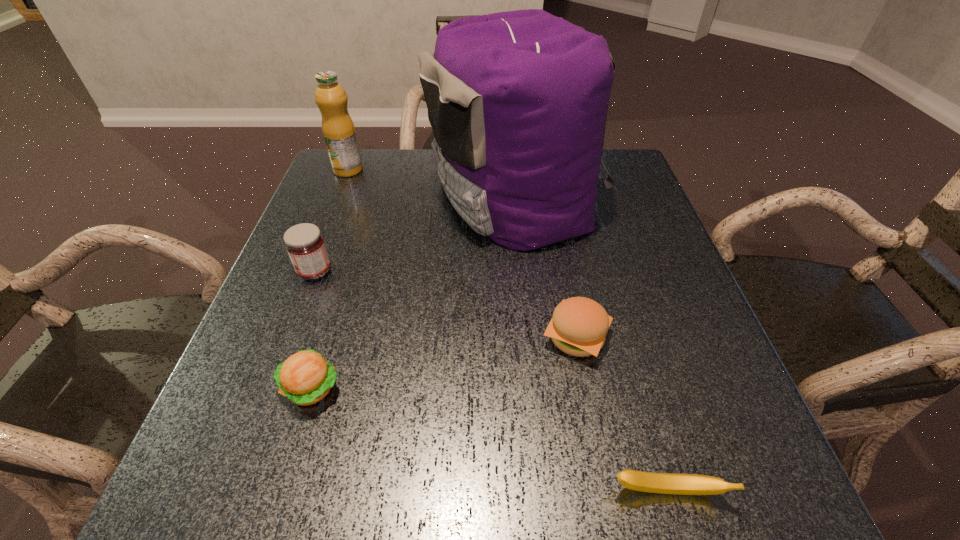
The width and height of the screenshot is (960, 540). I want to click on hamburger located in the left edge section of the desktop, so click(x=305, y=378).

This screenshot has height=540, width=960. I want to click on backpack at the right edge, so [x=517, y=101].

Locate an element on the screen. The height and width of the screenshot is (540, 960). banana situated at the right edge is located at coordinates (664, 483).

What are the coordinates of `object at the far left corner` in the screenshot? It's located at (338, 129).

Where is `object at the far right corner`? object at the far right corner is located at coordinates (517, 101).

This screenshot has width=960, height=540. What are the coordinates of `object present at the near right corner` in the screenshot? It's located at (664, 483).

In the image, there is a desktop. Where is `free space at the left edge`? free space at the left edge is located at coordinates (278, 365).

The height and width of the screenshot is (540, 960). In the image, there is a desktop. In order to click on vacant space at the right edge in this screenshot , I will do `click(627, 202)`.

Find the location of a particular element. The height and width of the screenshot is (540, 960). blank space at the far right corner is located at coordinates (609, 157).

Where is `empty location between the right hamburger and the backpack`? This screenshot has width=960, height=540. empty location between the right hamburger and the backpack is located at coordinates (545, 267).